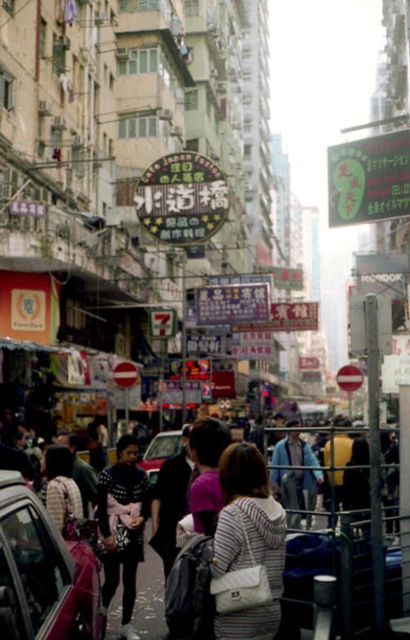
You are a delivery person who needs to place the white quilted purse at center into the trunk of the metallic silver car at center. Considering their sizes, will the purse fit comfortably inside the trunk?

The white quilted purse at center is smaller than the metallic silver car at center, so it will fit comfortably inside the trunk.